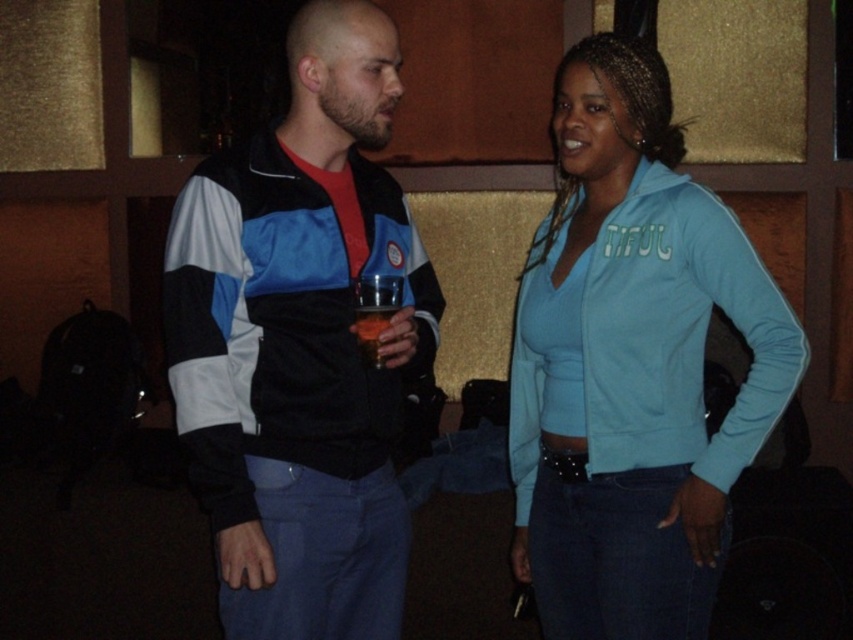
You are at a party and want to hand a drink to the person wearing the light blue fleece jacket at center. The drink is in the translucent plastic cup at center. Can you reach the cup without moving the jacket?

The light blue fleece jacket at center is closer to the viewer than the translucent plastic cup at center, so you would need to move the jacket to reach the cup.

You are standing in a room with two people. The man on the left is wearing a black jacket with white and blue accents, and the woman on the right has a light blue zip jacket with the word TIFUL in green. There is a point at coordinates [300,342]. Which object is this point located on?

The point at coordinates [300,342] is located on the matte black jacket at center.